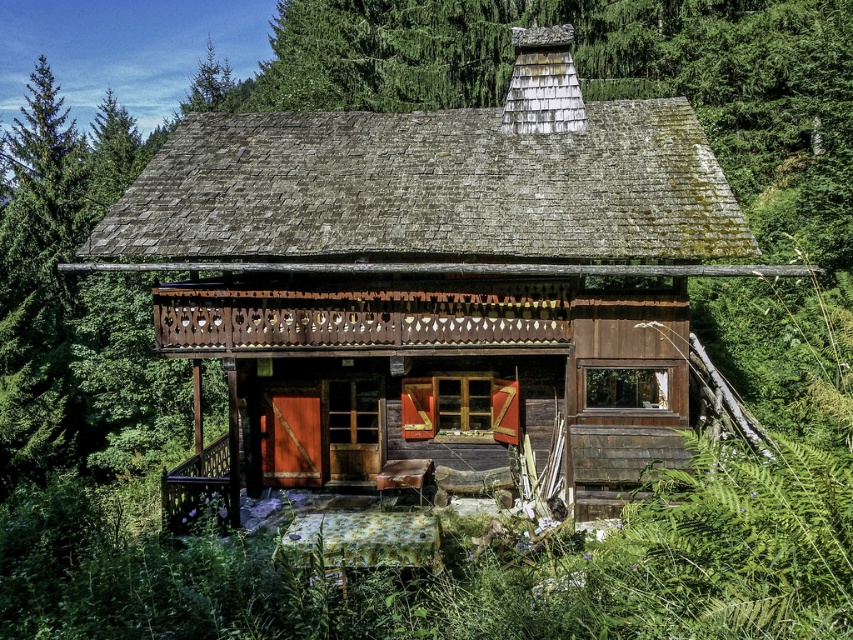
Which is below, rustic wooden cabin at center or wooden porch at center?

Positioned lower is wooden porch at center.

Measure the distance from rustic wooden cabin at center to wooden porch at center.

2.65 meters

Between point (374, 246) and point (239, 518), which one is positioned in front?

Point (374, 246) is in front.

Locate an element on the screen. Image resolution: width=853 pixels, height=640 pixels. rustic wooden cabin at center is located at coordinates (437, 276).